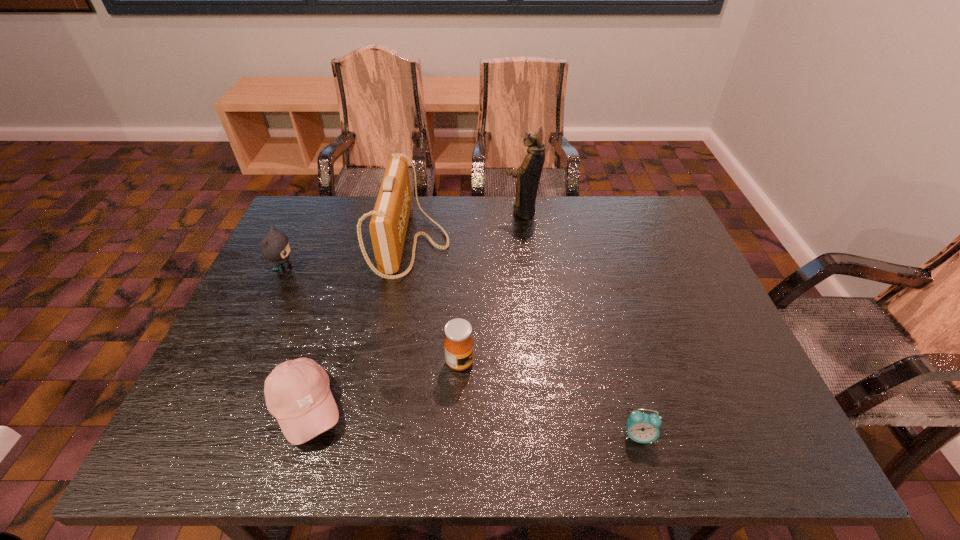
Find the location of a particular element. Image resolution: width=960 pixels, height=540 pixels. baseball cap at the left edge is located at coordinates (297, 392).

This screenshot has width=960, height=540. In order to click on object present at the near left corner in this screenshot , I will do `click(297, 392)`.

In the image, there is a desktop. In order to click on vacant space at the far edge in this screenshot , I will do `click(606, 196)`.

Where is `vacant space at the near edge of the desktop`? The image size is (960, 540). vacant space at the near edge of the desktop is located at coordinates (445, 448).

You are a GUI agent. You are given a task and a screenshot of the screen. Output one action in this format:
    pyautogui.click(x=<x>, y=<y>)
    Task: Click on the vacant region at the left edge of the desktop
    This screenshot has height=540, width=960.
    Given the screenshot: What is the action you would take?
    pyautogui.click(x=280, y=359)

This screenshot has height=540, width=960. In the image, there is a desktop. What are the coordinates of `vacant space at the right edge` in the screenshot? It's located at (660, 320).

The image size is (960, 540). Identify the location of vacant region between the baseball cap and the alarm clock. (472, 422).

Image resolution: width=960 pixels, height=540 pixels. Identify the location of unoccupied position between the alarm clock and the fourth object from left to right. (549, 399).

You are a GUI agent. You are given a task and a screenshot of the screen. Output one action in this format:
    pyautogui.click(x=<x>, y=<y>)
    Task: Click on the free space between the leftmost object and the baseball cap
    This screenshot has width=960, height=540.
    Given the screenshot: What is the action you would take?
    coord(296,339)

Where is `free spot between the second shortest object and the shortest object`? This screenshot has width=960, height=540. free spot between the second shortest object and the shortest object is located at coordinates [472, 422].